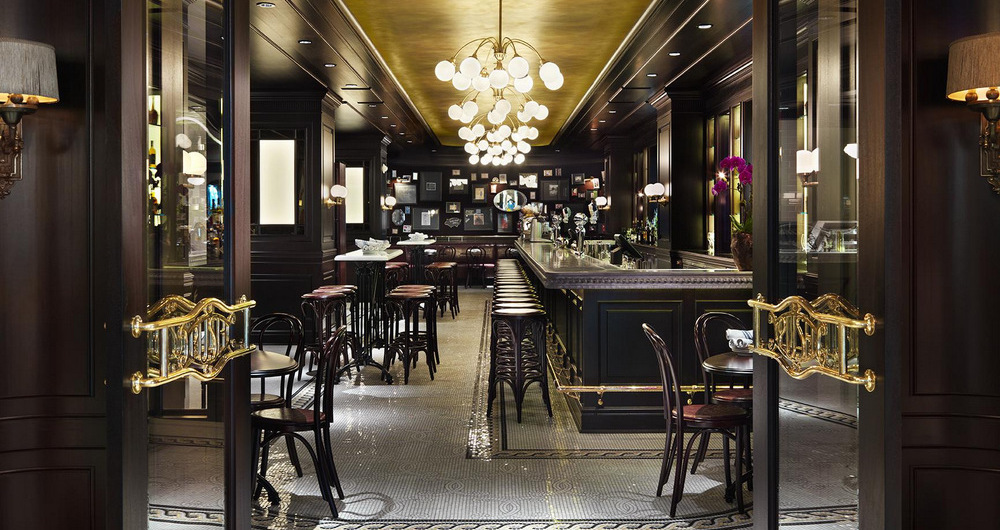
At what (x,y) coordinates should I click in order to perform the action: click on tables. Please return your answer as a coordinate pair (x, y). The height and width of the screenshot is (530, 1000). Looking at the image, I should click on (274, 362), (729, 363), (365, 258), (415, 238), (476, 248).